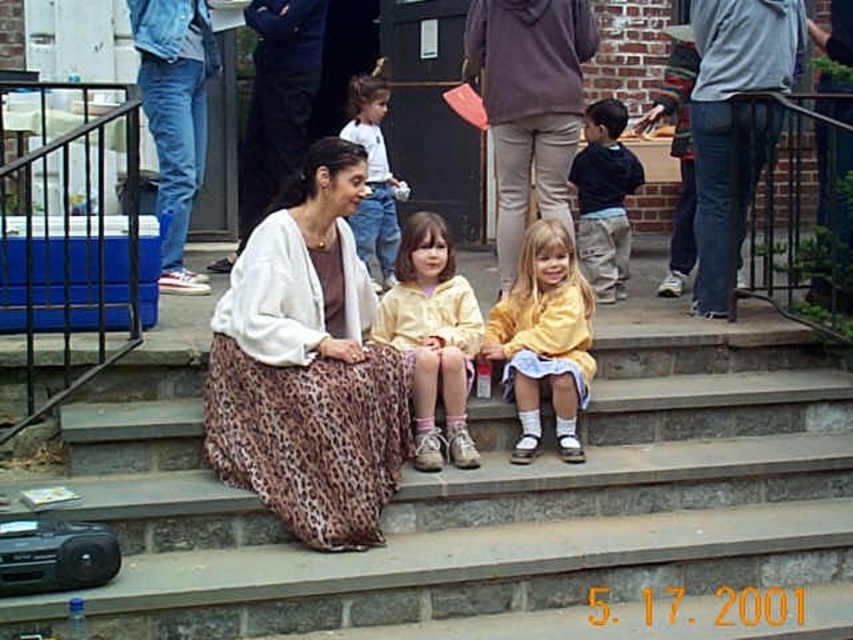
Question: Based on their relative distances, which object is farther from the dark blue shirt at right?

Choices:
 (A) leopard print skirt at center
 (B) light brown hair at center
 (C) gray cotton hoodie at upper right

Answer: (A)

Question: Does brown leopard print skirt at center appear under leopard print skirt at center?

Choices:
 (A) no
 (B) yes

Answer: (B)

Question: Can you confirm if gray cotton hoodie at upper right is bigger than yellow fleece jacket at center?

Choices:
 (A) yes
 (B) no

Answer: (A)

Question: Which point is farther from the camera taking this photo?

Choices:
 (A) (364, 259)
 (B) (415, 531)

Answer: (A)

Question: Which is farther from the gray cotton hoodie at upper right?

Choices:
 (A) matte brown hoodie at center
 (B) leopard print skirt at center
 (C) brown leopard print skirt at center
 (D) light brown hair at center

Answer: (B)

Question: Is matte brown hoodie at center smaller than yellow fleece jacket at center?

Choices:
 (A) no
 (B) yes

Answer: (A)